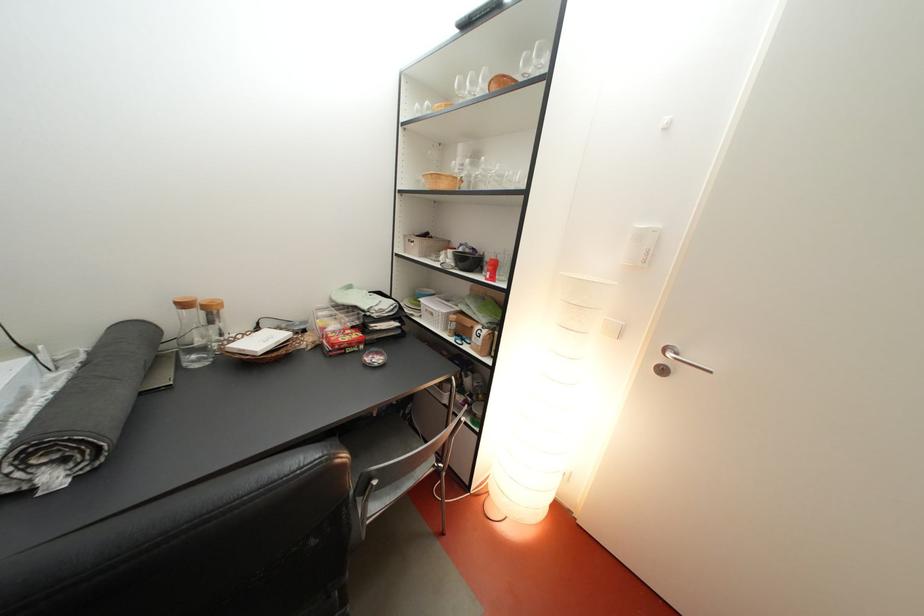
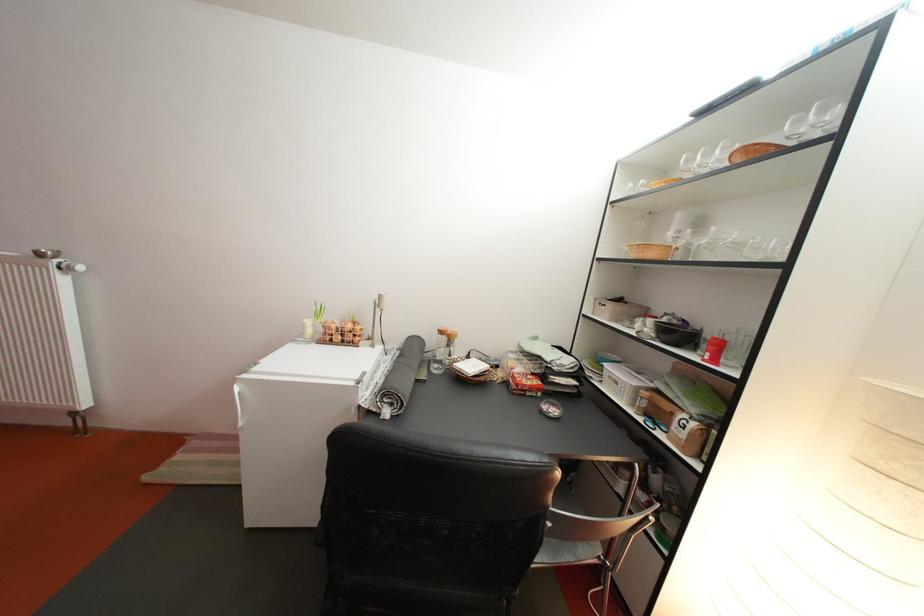
In the second image, find the point that corresponds to point (468, 341) in the first image.

(658, 421)